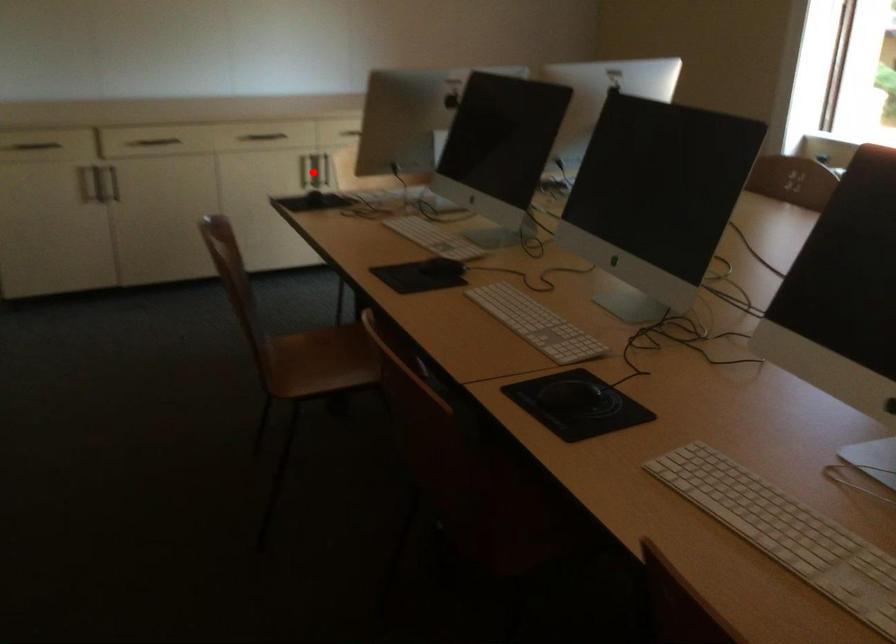
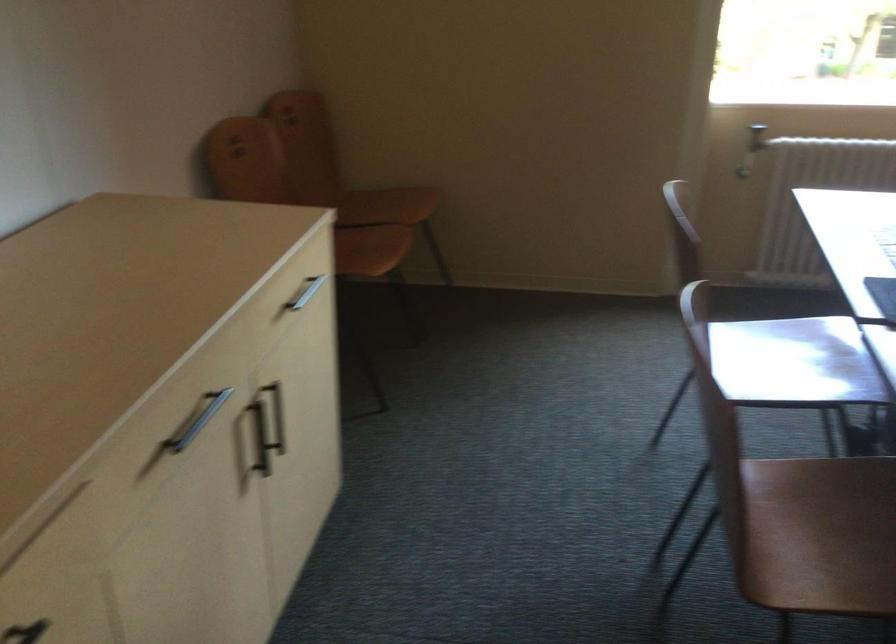
Question: A red point is marked in image1. In image2, is the corresponding 3D point closer to the camera or farther? Reply with the corresponding letter.

Choices:
 (A) The corresponding 3D point is closer.
 (B) The corresponding 3D point is farther.

Answer: (A)